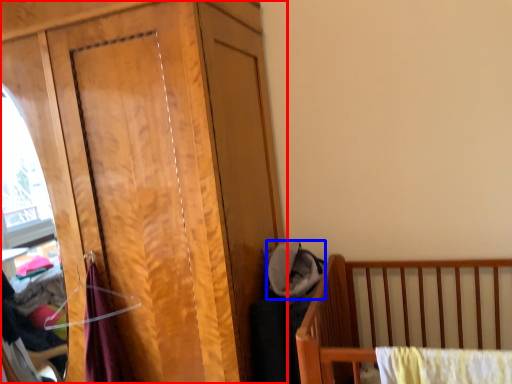
Question: Which of the following is the farthest to the observer, dresser (highlighted by a red box) or baby clothe (highlighted by a blue box)?

Choices:
 (A) dresser
 (B) baby clothe

Answer: (B)